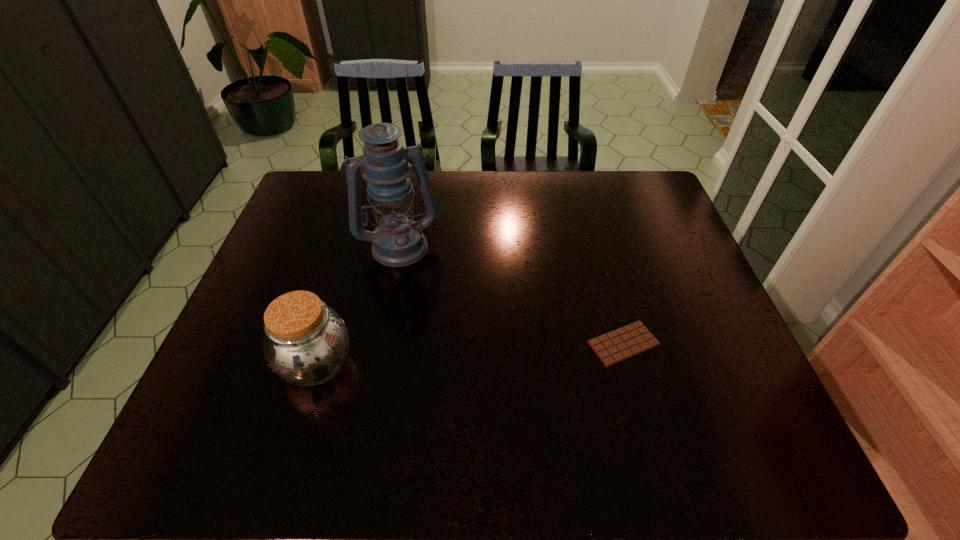
I want to click on the second shortest object, so click(x=306, y=343).

Locate an element on the screen. candy bar is located at coordinates (618, 345).

Identify the location of the rightmost object. The width and height of the screenshot is (960, 540). (618, 345).

In order to click on the tallest object in this screenshot , I will do `click(398, 240)`.

You are a GUI agent. You are given a task and a screenshot of the screen. Output one action in this format:
    pyautogui.click(x=<x>, y=<y>)
    Task: Click on the farthest object
    The width and height of the screenshot is (960, 540).
    Given the screenshot: What is the action you would take?
    pyautogui.click(x=398, y=240)

This screenshot has width=960, height=540. I want to click on vacant region located 0.340m on the back of the jar, so click(x=354, y=241).

Locate an element on the screen. Image resolution: width=960 pixels, height=540 pixels. free space located 0.220m on the left of the rightmost object is located at coordinates (495, 343).

I want to click on vacant space located on the front-facing side of the lantern, so click(449, 370).

Where is `vacant space situated 0.130m on the front-facing side of the lantern`? The image size is (960, 540). vacant space situated 0.130m on the front-facing side of the lantern is located at coordinates (422, 299).

Identify the location of vacant space located 0.320m on the front-facing side of the lantern. (444, 356).